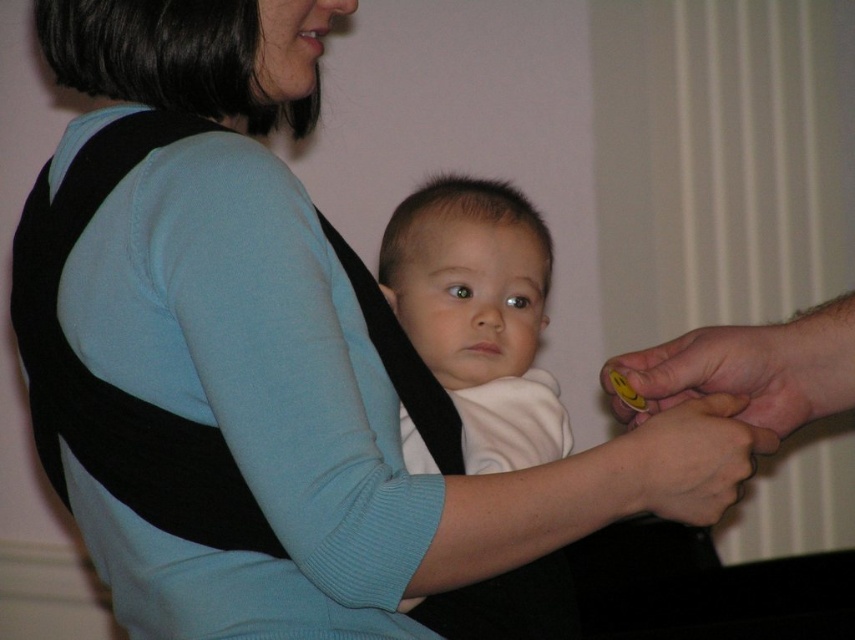
Question: Is white soft baby at center bigger than yellow rubber ring at right?

Choices:
 (A) no
 (B) yes

Answer: (B)

Question: Where is white soft baby at center located in relation to yellow rubber ring at right in the image?

Choices:
 (A) above
 (B) below

Answer: (A)

Question: Which point is closer to the camera?

Choices:
 (A) (469, 602)
 (B) (681, 348)
 (C) (644, 429)

Answer: (C)

Question: Is yellow rubber ring at right positioned before smooth skin hand at lower right?

Choices:
 (A) no
 (B) yes

Answer: (A)

Question: Which of the following is the farthest from the observer?

Choices:
 (A) (734, 387)
 (B) (543, 445)
 (C) (736, 461)

Answer: (B)

Question: Which object appears farthest from the camera in this image?

Choices:
 (A) yellow rubber ring at right
 (B) smooth skin hand at lower right

Answer: (A)